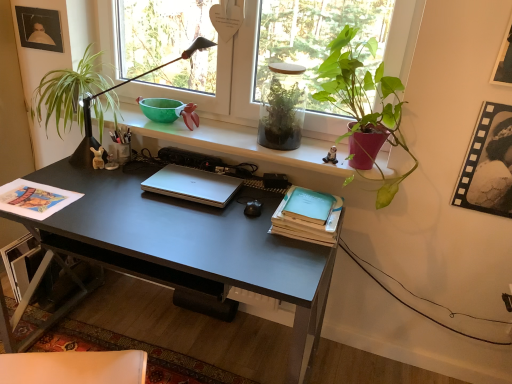
You are a GUI agent. You are given a task and a screenshot of the screen. Output one action in this format:
    pyautogui.click(x=<x>, y=<y>)
    Task: Click on the vacant space positioned to the left of light blue matte paper at center right, the second paperback book when ordered from top to bottom
    This screenshot has width=512, height=384.
    Given the screenshot: What is the action you would take?
    pyautogui.click(x=241, y=221)